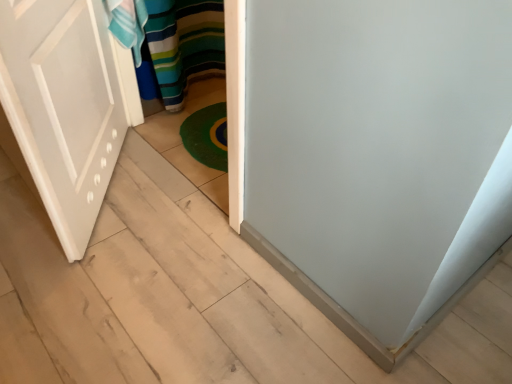
This screenshot has width=512, height=384. Identify the location of free region under white matte door at left (from a real-world perspective). (113, 190).